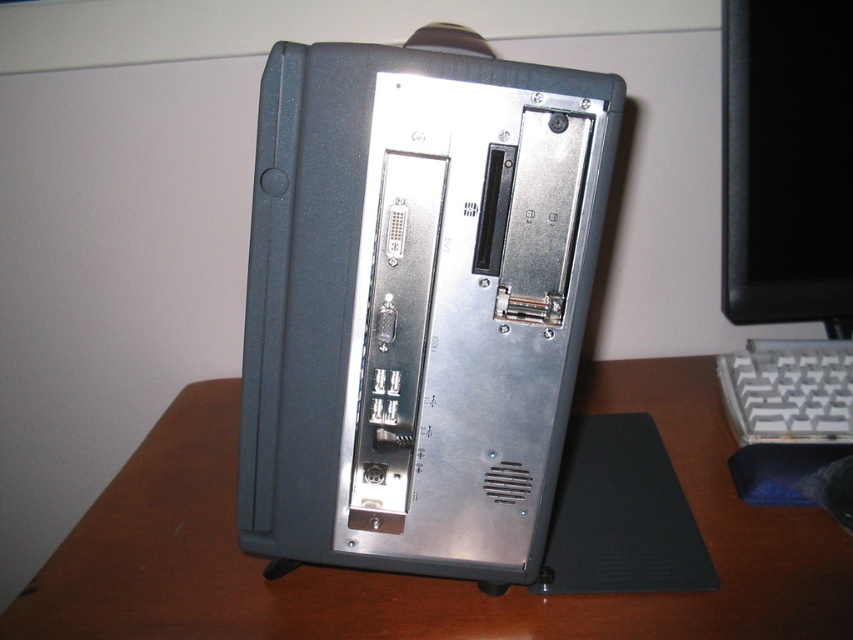
Question: Estimate the real-world distances between objects in this image. Which object is closer to the white plastic keyboard at lower right?

Choices:
 (A) brown wood computer desk at center
 (B) black glossy monitor at upper right
 (C) satin black computer at center

Answer: (B)

Question: Does satin black computer at center appear on the left side of black glossy monitor at upper right?

Choices:
 (A) yes
 (B) no

Answer: (A)

Question: Considering the relative positions of black glossy monitor at upper right and white plastic keyboard at lower right in the image provided, where is black glossy monitor at upper right located with respect to white plastic keyboard at lower right?

Choices:
 (A) left
 (B) right

Answer: (A)

Question: Is black glossy monitor at upper right to the right of white plastic keyboard at lower right from the viewer's perspective?

Choices:
 (A) yes
 (B) no

Answer: (B)

Question: Which of the following is the closest to the observer?

Choices:
 (A) (257, 557)
 (B) (822, 296)
 (C) (758, 378)

Answer: (A)

Question: Which point is farther to the camera?

Choices:
 (A) (845, 125)
 (B) (772, 349)
 (C) (433, 348)

Answer: (B)